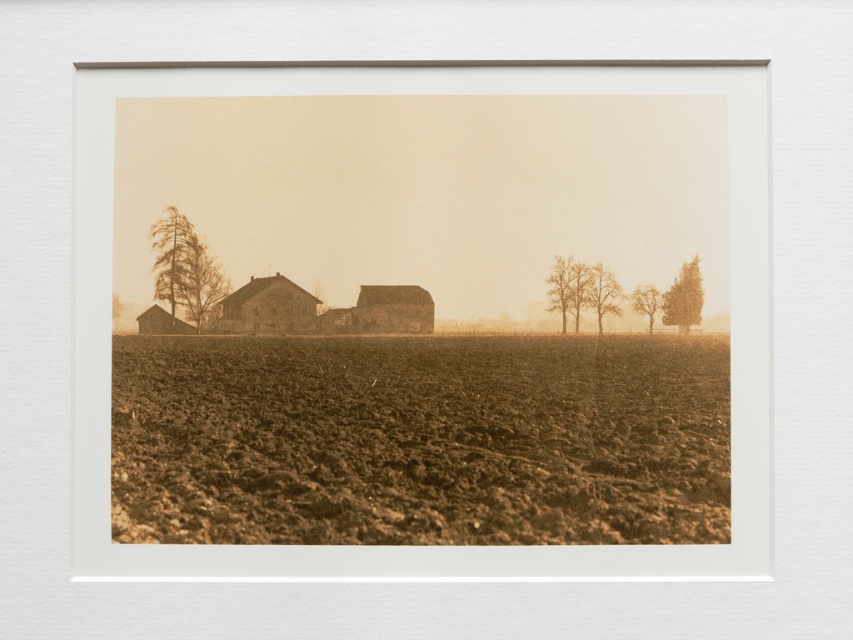
Question: Is brown soil at center to the right of smooth brown tree at right from the viewer's perspective?

Choices:
 (A) no
 (B) yes

Answer: (A)

Question: Which object is the farthest from the brown soil at center?

Choices:
 (A) sepia brick barn at center
 (B) smooth bark tree at center right

Answer: (B)

Question: Is sepia brick barn at center further to camera compared to sepia textured tree at left?

Choices:
 (A) yes
 (B) no

Answer: (A)

Question: Among these points, which one is nearest to the camera?

Choices:
 (A) (685, 301)
 (B) (302, 314)

Answer: (A)

Question: Does smooth bark tree at center come in front of smooth brown tree at right?

Choices:
 (A) yes
 (B) no

Answer: (B)

Question: Which object is positioned farthest from the brown textured tree at right?

Choices:
 (A) sepia brick barn at center
 (B) sepia textured tree at left
 (C) smooth bark tree at center right

Answer: (B)